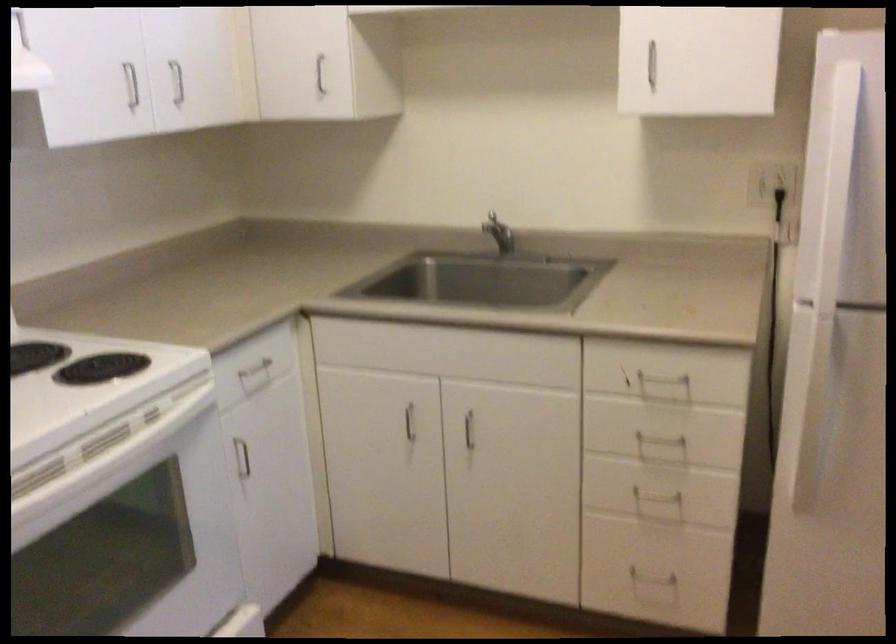
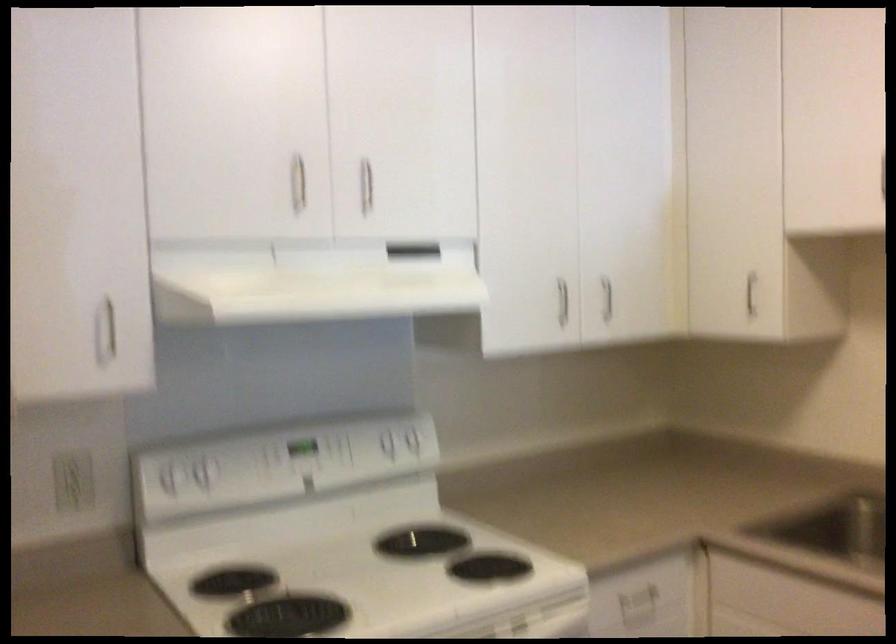
Question: The camera is either moving clockwise (left) or counter-clockwise (right) around the object. The first image is from the beginning of the video and the second image is from the end. Is the camera moving left or right when shooting the video?

Choices:
 (A) Left
 (B) Right

Answer: (B)